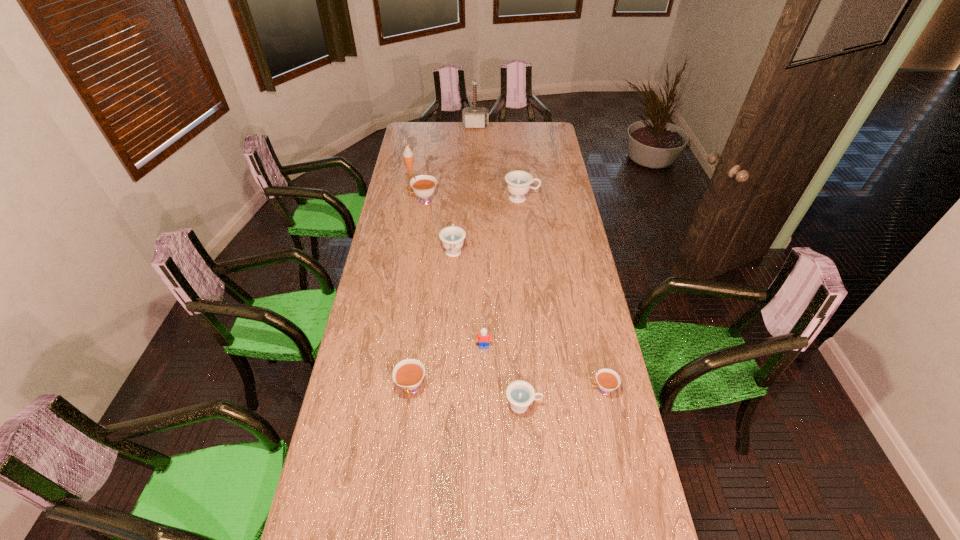
You are a GUI agent. You are given a task and a screenshot of the screen. Output one action in this format:
    pyautogui.click(x=<x>, y=<y>)
    Task: Click on the fifth closest object to the rightmost white teacup
    This screenshot has height=540, width=960.
    Given the screenshot: What is the action you would take?
    pyautogui.click(x=518, y=182)

At what (x,y) coordinates should I click in order to perform the action: click on the fourth closest object to the second smallest white teacup. Please return your answer as a coordinate pair (x, y). The height and width of the screenshot is (540, 960). Looking at the image, I should click on (452, 237).

The image size is (960, 540). Identify the location of teacup that stands as the second closest to the farthest blue teacup. (424, 185).

Identify which teacup is the second nearest to the biggest blue teacup. Please provide its 2D coordinates. Your answer should be formatted as a tuple, i.e. [(x, y)], where the tuple contains the x and y coordinates of a point satisfying the conditions above.

[(424, 185)]

The image size is (960, 540). I want to click on blue teacup that is the closest one to the farthest object, so click(518, 182).

Image resolution: width=960 pixels, height=540 pixels. I want to click on blue teacup that is the second nearest to the leftmost object, so click(x=452, y=237).

Select which white teacup appears as the second closest to the rightmost white teacup. Please provide its 2D coordinates. Your answer should be formatted as a tuple, i.e. [(x, y)], where the tuple contains the x and y coordinates of a point satisfying the conditions above.

[(424, 185)]

Locate which white teacup is the third closest to the smallest blue teacup. Please provide its 2D coordinates. Your answer should be formatted as a tuple, i.e. [(x, y)], where the tuple contains the x and y coordinates of a point satisfying the conditions above.

[(424, 185)]

Identify the location of vacant region that satisfies the following two spatial constraints: 1. on the side of the biggest blue teacup with the handle; 2. on the side of the second biggest white teacup with the handle. This screenshot has width=960, height=540. (542, 389).